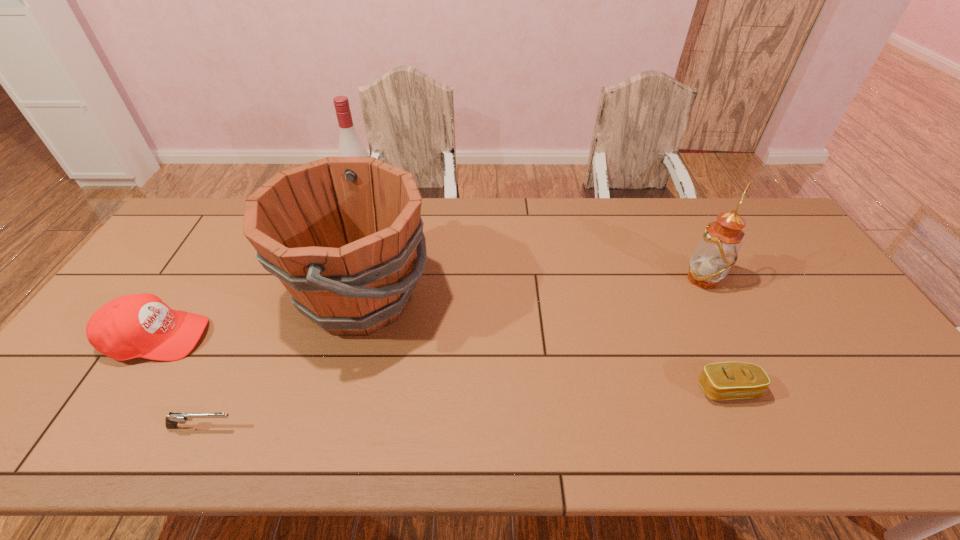
Find the location of a particular element. alcohol is located at coordinates (350, 145).

You are a GUI agent. You are given a task and a screenshot of the screen. Output one action in this format:
    pyautogui.click(x=<x>, y=<y>)
    Task: Click on the bucket
    The image size is (960, 540).
    Given the screenshot: What is the action you would take?
    pyautogui.click(x=340, y=233)

This screenshot has height=540, width=960. What are the coordinates of `oil lamp` in the screenshot? It's located at (717, 251).

The width and height of the screenshot is (960, 540). Find the location of `baseball cap`. baseball cap is located at coordinates (141, 325).

Find the location of a particular element. Image resolution: width=960 pixels, height=540 pixels. the leftmost object is located at coordinates tap(141, 325).

This screenshot has width=960, height=540. Identify the location of clutch bag. (725, 380).

Find the location of a particular element. pistol is located at coordinates (171, 422).

Where is `free region located 0.200m on the label of the alcohol`? free region located 0.200m on the label of the alcohol is located at coordinates (349, 252).

Find the location of a particular element. This screenshot has height=540, width=960. vacant space located on the handle side of the bucket is located at coordinates (501, 297).

Where is `vacant area situated 0.340m on the back of the oil lamp`? The width and height of the screenshot is (960, 540). vacant area situated 0.340m on the back of the oil lamp is located at coordinates (664, 202).